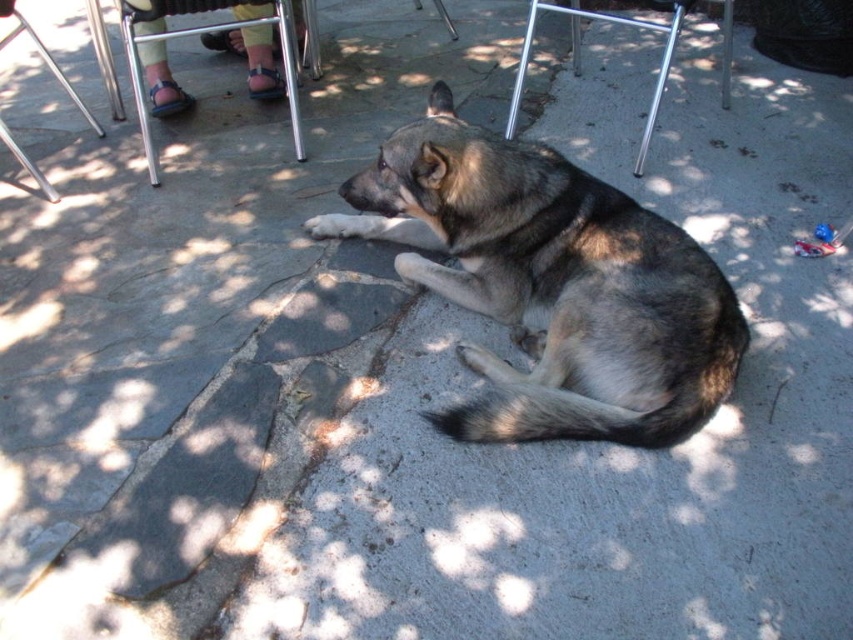
Question: Among these points, which one is nearest to the camera?

Choices:
 (A) (410, 204)
 (B) (41, 186)
 (C) (520, 97)
 (D) (141, 44)

Answer: (A)

Question: Among these objects, which one is farthest from the camera?

Choices:
 (A) metallic silver chair at upper left
 (B) metallic silver chair at upper center

Answer: (A)

Question: Is gray fur dog at center to the left of metallic silver chair at upper center from the viewer's perspective?

Choices:
 (A) yes
 (B) no

Answer: (A)

Question: Does metallic silver chair at upper left appear under brushed metal chair at upper left?

Choices:
 (A) no
 (B) yes

Answer: (A)

Question: Is metallic silver chair at upper left behind brushed metal chair at upper left?

Choices:
 (A) no
 (B) yes

Answer: (B)

Question: Which point is farther to the camera?

Choices:
 (A) metallic silver chair at upper left
 (B) brushed metal chair at upper left

Answer: (A)